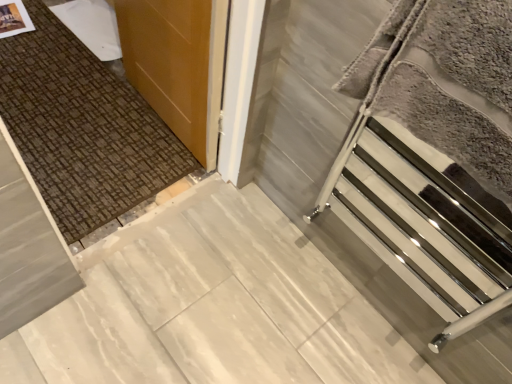
Question: From a real-world perspective, is wooden door at upper left physically located above or below silver metallic towel rack at right?

Choices:
 (A) above
 (B) below

Answer: (B)

Question: In terms of width, does wooden door at upper left look wider or thinner when compared to silver metallic towel rack at right?

Choices:
 (A) wide
 (B) thin

Answer: (B)

Question: Estimate the real-world distances between objects in this image. Which object is farther from the silver metallic towel rack at right?

Choices:
 (A) white marble concrete at center
 (B) wooden door at upper left
 (C) polished chrome towel rack at right

Answer: (A)

Question: Considering the real-world distances, which object is closest to the white marble concrete at center?

Choices:
 (A) silver metallic towel rack at right
 (B) polished chrome towel rack at right
 (C) wooden door at upper left

Answer: (B)